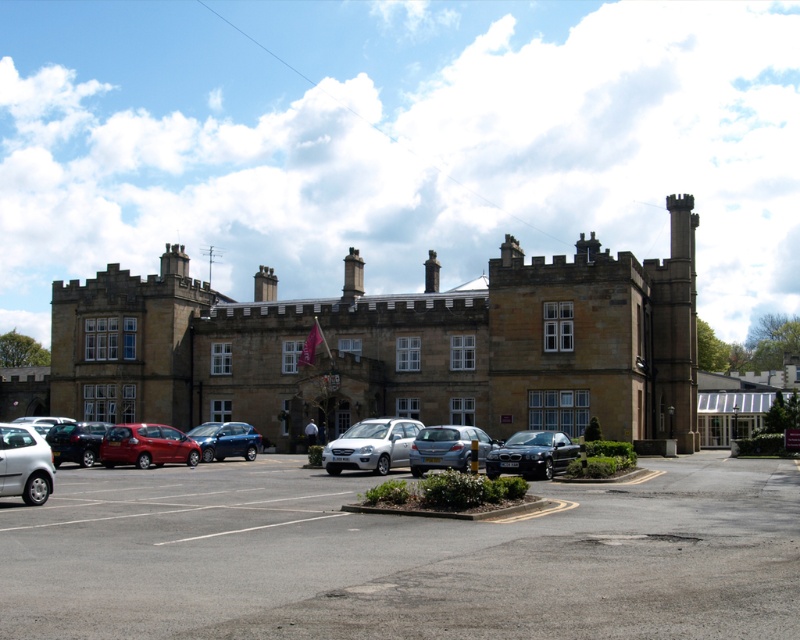
Is point (8, 484) positioned behind point (432, 451)?

No, (8, 484) is in front of (432, 451).

Locate an element on the screen. silver metallic hatchback at lower left is located at coordinates coord(24,465).

Locate an element on the screen. silver metallic hatchback at lower left is located at coordinates (24, 465).

Is gray asphalt parking lot at center taller than satin silver sedan at center?

Indeed, gray asphalt parking lot at center has a greater height compared to satin silver sedan at center.

Which is below, gray asphalt parking lot at center or satin silver sedan at center?

gray asphalt parking lot at center is lower down.

Who is more distant from viewer, (x=164, y=564) or (x=409, y=467)?

Point (x=409, y=467)

Identify the location of gray asphalt parking lot at center. (402, 556).

Is brown stone building at center in front of shiny black sedan at center?

No, it is not.

Is point (600, 321) less distant than point (552, 452)?

No, (600, 321) is behind (552, 452).

At what (x,y) coordinates should I click in order to perform the action: click on brown stone building at center. Please return your answer as a coordinate pair (x, y). The width and height of the screenshot is (800, 640). Looking at the image, I should click on (396, 346).